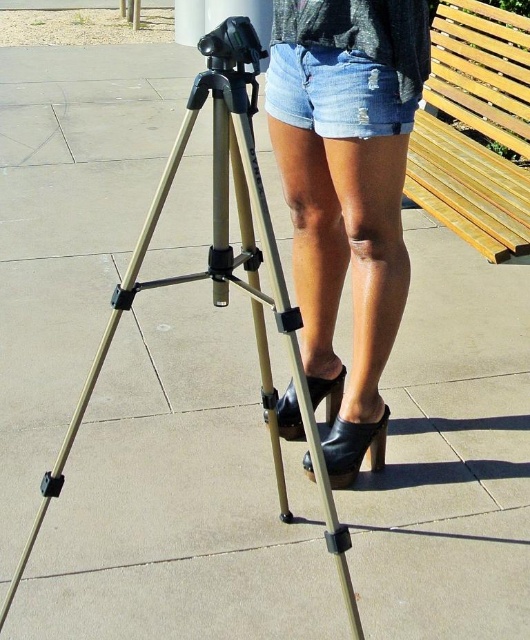
You are a photographer setting up your equipment. You have a light brown wooden bench at upper right and denim shorts at upper center in your view. Which object is taller in the scene?

The light brown wooden bench at upper right is taller than the denim shorts at upper center.

You are a photographer setting up equipment. You have a pair of denim shorts at center and a light brown wooden bench at upper right. Which object has a smaller width?

The denim shorts at center has a smaller width than the light brown wooden bench at upper right.

You are a photographer standing at the center of the image. You notice the denim shorts at center and the metallic tripod at center. Which object is taller when viewed from your perspective?

The metallic tripod at center is taller than the denim shorts at center.